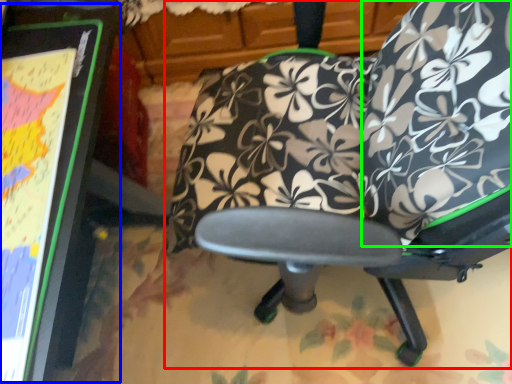
Question: Estimate the real-world distances between objects in this image. Which object is farther from chair (highlighted by a red box), bulletin board (highlighted by a blue box) or bean bag chair (highlighted by a green box)?

Choices:
 (A) bulletin board
 (B) bean bag chair

Answer: (A)